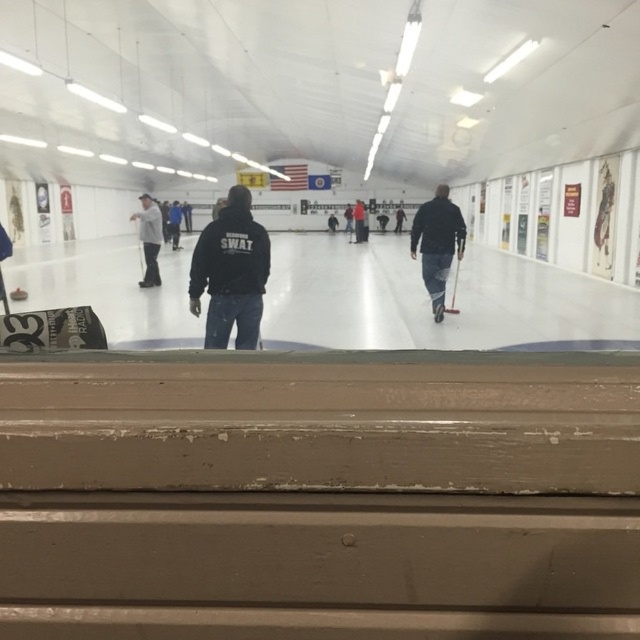
Who is more distant from viewer, (428, 262) or (356, 236)?

Positioned behind is point (356, 236).

This screenshot has width=640, height=640. In order to click on dark blue jeans at center in this screenshot , I will do [436, 243].

Who is more distant from viewer, (458, 252) or (360, 225)?

Point (360, 225)

At what (x,y) coordinates should I click in order to perform the action: click on dark blue jeans at center. Please return your answer as a coordinate pair (x, y). Image resolution: width=640 pixels, height=640 pixels. Looking at the image, I should click on (436, 243).

Describe the element at coordinates (436, 243) in the screenshot. I see `dark blue jeans at center` at that location.

Which is above, dark blue jeans at center or gray knit cap at left?

gray knit cap at left

What do you see at coordinates (436, 243) in the screenshot?
I see `dark blue jeans at center` at bounding box center [436, 243].

The width and height of the screenshot is (640, 640). I want to click on dark blue jeans at center, so pyautogui.click(x=436, y=243).

Is gray knit cap at left behind dark blue jacket at center?

No, it is in front of dark blue jacket at center.

Is point (145, 212) positioned behind point (365, 227)?

No.

What are the coordinates of `gray knit cap at left` in the screenshot? It's located at coord(148,237).